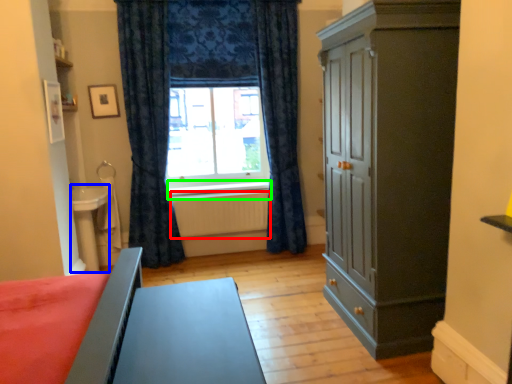
Question: Which is farther away from radiator (highlighted by a red box)? table (highlighted by a blue box) or window sill (highlighted by a green box)?

Choices:
 (A) table
 (B) window sill

Answer: (A)